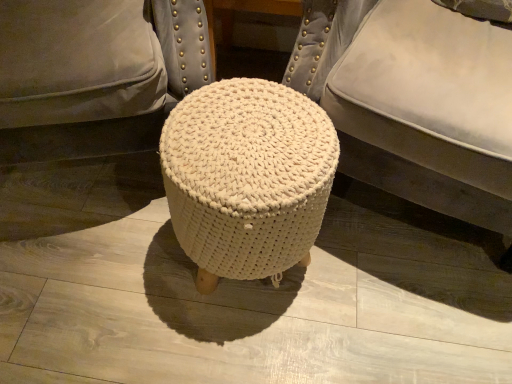
Question: From the image's perspective, is white knitted stool at center on top of white knitted pouf at center?

Choices:
 (A) yes
 (B) no

Answer: (B)

Question: Is the position of white knitted stool at center more distant than that of white knitted pouf at center?

Choices:
 (A) no
 (B) yes

Answer: (B)

Question: Does white knitted stool at center have a greater width compared to white knitted pouf at center?

Choices:
 (A) yes
 (B) no

Answer: (B)

Question: Is white knitted stool at center not near white knitted pouf at center?

Choices:
 (A) yes
 (B) no

Answer: (B)

Question: Can white knitted pouf at center be found inside white knitted stool at center?

Choices:
 (A) no
 (B) yes

Answer: (A)

Question: Can we say white knitted stool at center lies outside white knitted pouf at center?

Choices:
 (A) yes
 (B) no

Answer: (A)

Question: Considering the relative sizes of white knitted pouf at center and white knitted stool at center in the image provided, is white knitted pouf at center taller than white knitted stool at center?

Choices:
 (A) yes
 (B) no

Answer: (A)

Question: Is the depth of white knitted pouf at center less than that of white knitted stool at center?

Choices:
 (A) no
 (B) yes

Answer: (B)

Question: Does white knitted pouf at center appear on the right side of white knitted stool at center?

Choices:
 (A) no
 (B) yes

Answer: (B)

Question: Considering the relative sizes of white knitted pouf at center and white knitted stool at center in the image provided, is white knitted pouf at center shorter than white knitted stool at center?

Choices:
 (A) no
 (B) yes

Answer: (A)

Question: Is white knitted pouf at center turned away from white knitted stool at center?

Choices:
 (A) yes
 (B) no

Answer: (B)

Question: Is white knitted pouf at center behind white knitted stool at center?

Choices:
 (A) no
 (B) yes

Answer: (A)

Question: Is white knitted stool at center in front of or behind white knitted pouf at center in the image?

Choices:
 (A) front
 (B) behind

Answer: (B)